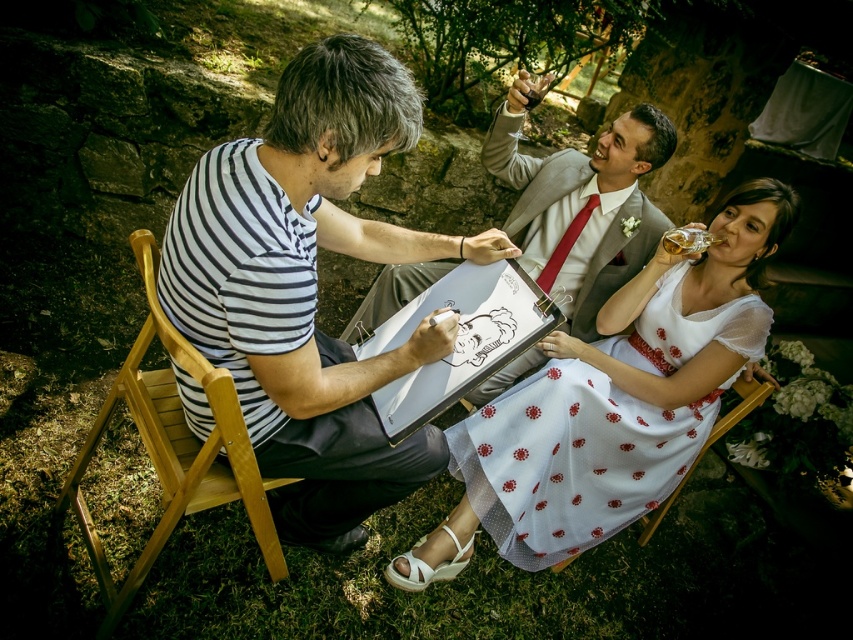
Question: Can you confirm if striped cotton shirt at center is smaller than white dotted fabric dress at lower right?

Choices:
 (A) no
 (B) yes

Answer: (A)

Question: Which of the following is the closest to the observer?

Choices:
 (A) wooden chair at left
 (B) matte gray suit at center
 (C) striped cotton shirt at center

Answer: (C)

Question: Is matte gray suit at center thinner than wooden chair at left?

Choices:
 (A) no
 (B) yes

Answer: (A)

Question: Which point is closer to the camera taking this photo?

Choices:
 (A) (320, 100)
 (B) (77, 493)
 (C) (656, 525)
 (D) (554, 298)

Answer: (A)

Question: Can you confirm if wooden chair at left is smaller than wooden chair at lower center?

Choices:
 (A) yes
 (B) no

Answer: (B)

Question: Considering the real-world distances, which object is farthest from the wooden chair at lower center?

Choices:
 (A) striped cotton shirt at center
 (B) white dotted fabric dress at lower right
 (C) wooden chair at left

Answer: (C)